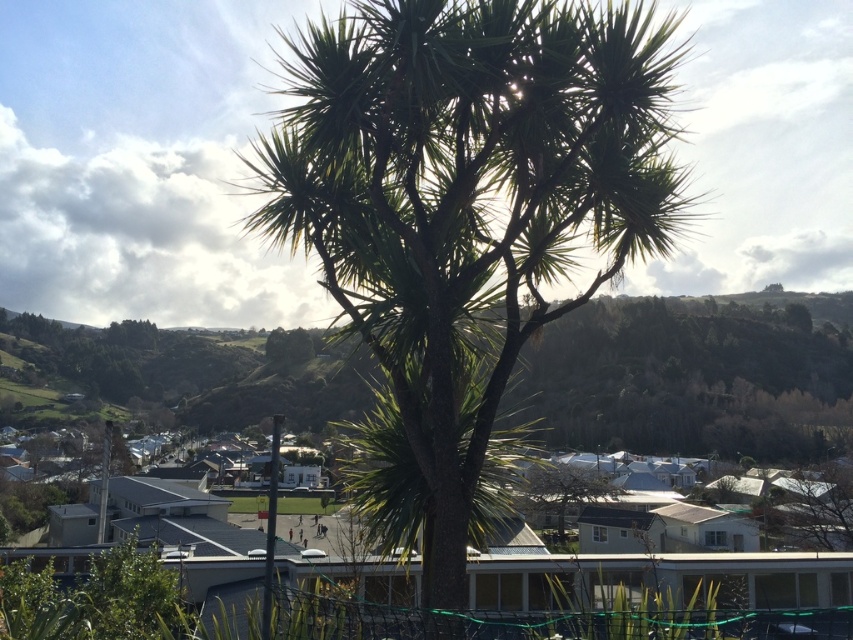
You are a landscape architect designing a garden. You have two trees in front of you, the green leafy palm tree at center and the green leafy tree at center. Which one should you choose if you want a smaller tree for a compact space?

You should choose the green leafy palm tree at center because it is smaller than the green leafy tree at center, making it suitable for compact spaces.

You are standing at the point marked by the coordinates point (468, 198) in the image. What object are you directly at?

You are directly at the green leafy palm tree at center, as the point (468, 198) represents its location.

You are standing in the suburban area and want to take a photo of both the green leafy palm tree at center and the green leafy tree at center. Which direction should you face to ensure both are in the frame?

Since the green leafy palm tree at center is to the left of the green leafy tree at center, you should face towards the right side of the green leafy palm tree at center to include both in your photo.